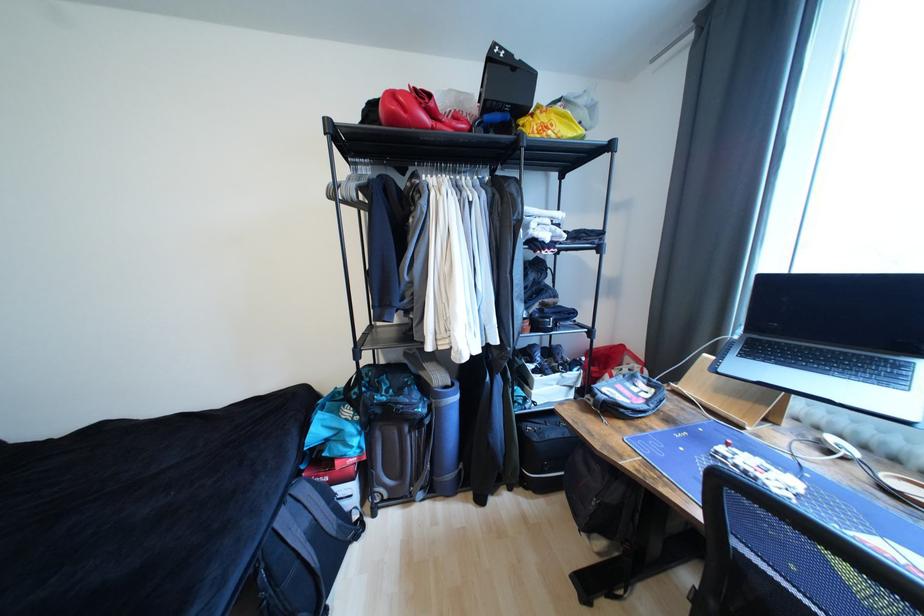
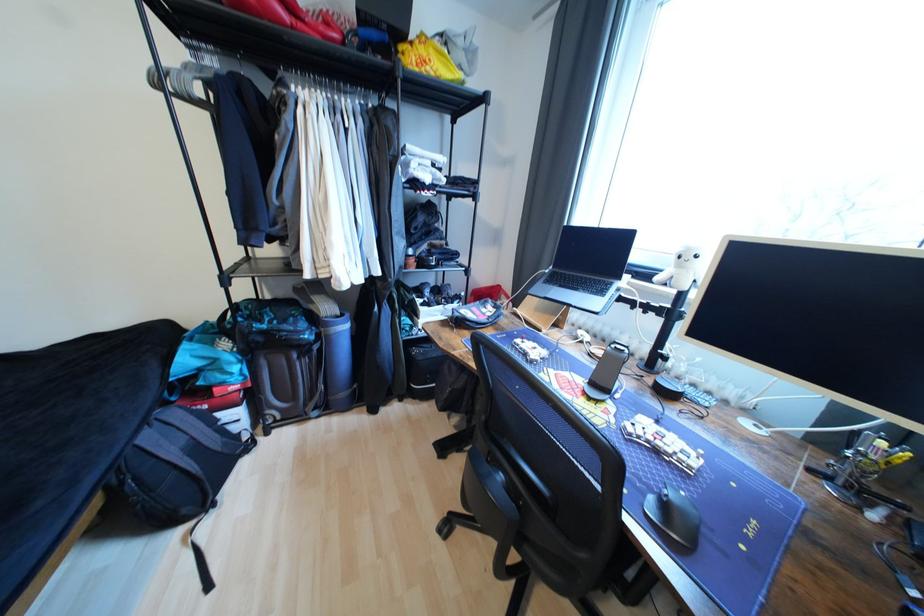
Find the pixel in the second image that matches point (528, 122) in the first image.

(407, 49)